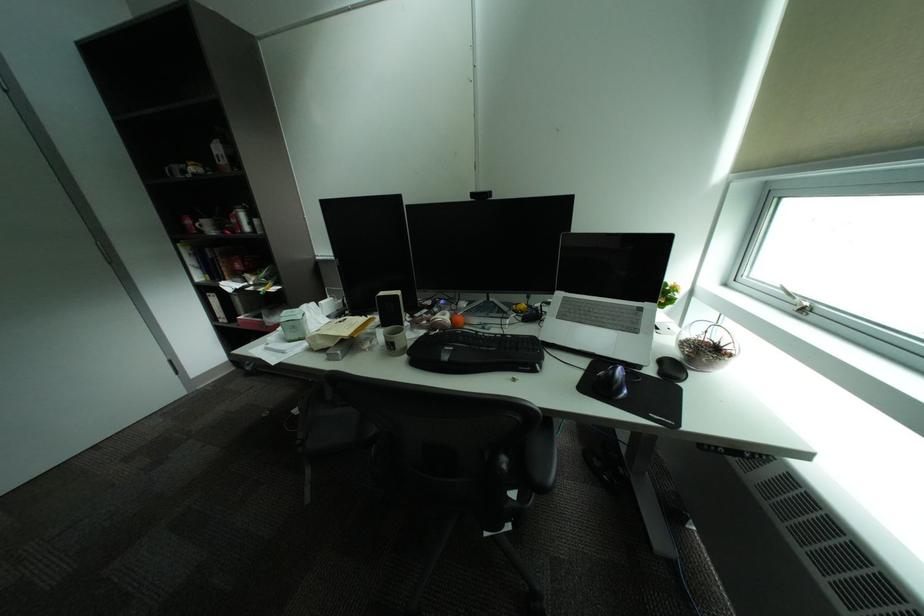
At what (x,y) coordinates should I click in order to perform the action: click on white ceramic mug. Please return your answer as a coordinate pair (x, y). Looking at the image, I should click on tap(208, 225).